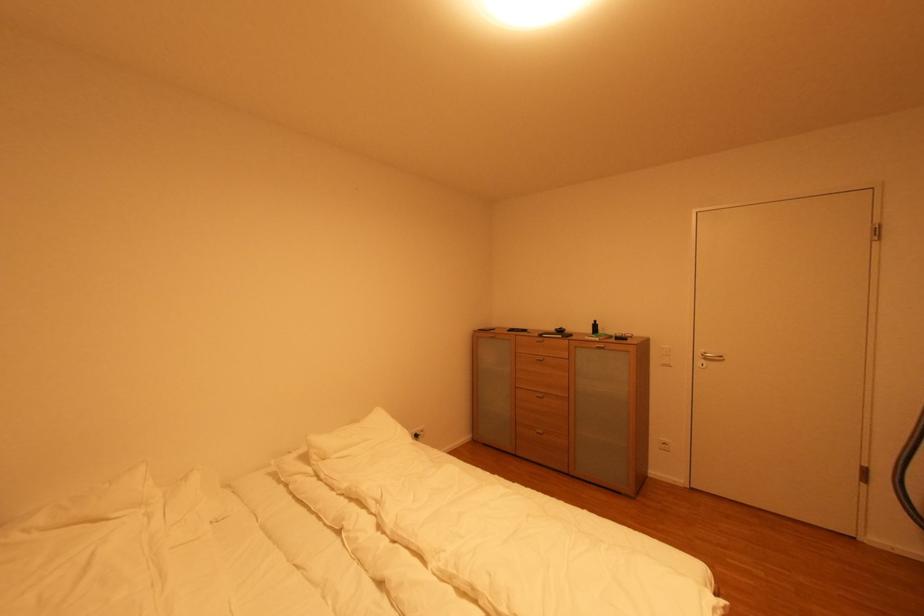
I want to click on black remote control, so click(528, 336).